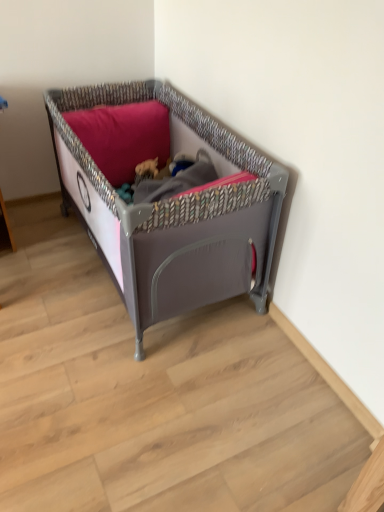
Question: Considering the relative sizes of matte gray plastic playpen at center and matte pink pillow at upper center in the image provided, is matte gray plastic playpen at center shorter than matte pink pillow at upper center?

Choices:
 (A) no
 (B) yes

Answer: (A)

Question: Is matte pink pillow at upper center at the back of matte gray plastic playpen at center?

Choices:
 (A) no
 (B) yes

Answer: (B)

Question: Considering the relative positions of matte gray plastic playpen at center and matte pink pillow at upper center in the image provided, is matte gray plastic playpen at center to the right of matte pink pillow at upper center from the viewer's perspective?

Choices:
 (A) no
 (B) yes

Answer: (B)

Question: Is matte gray plastic playpen at center positioned before matte pink pillow at upper center?

Choices:
 (A) yes
 (B) no

Answer: (A)

Question: Would you say matte pink pillow at upper center is part of matte gray plastic playpen at center's contents?

Choices:
 (A) no
 (B) yes

Answer: (B)

Question: From the image's perspective, is matte gray plastic playpen at center above matte pink pillow at upper center?

Choices:
 (A) yes
 (B) no

Answer: (B)

Question: Is matte pink pillow at upper center next to matte gray plastic playpen at center and touching it?

Choices:
 (A) no
 (B) yes

Answer: (A)

Question: Are matte pink pillow at upper center and matte gray plastic playpen at center far apart?

Choices:
 (A) no
 (B) yes

Answer: (A)

Question: From the image's perspective, does matte pink pillow at upper center appear higher than matte gray plastic playpen at center?

Choices:
 (A) no
 (B) yes

Answer: (B)

Question: From a real-world perspective, is matte pink pillow at upper center located higher than matte gray plastic playpen at center?

Choices:
 (A) yes
 (B) no

Answer: (A)

Question: Is matte pink pillow at upper center completely or partially outside of matte gray plastic playpen at center?

Choices:
 (A) yes
 (B) no

Answer: (B)

Question: Is matte pink pillow at upper center closer to the viewer compared to matte gray plastic playpen at center?

Choices:
 (A) no
 (B) yes

Answer: (A)

Question: Considering the positions of matte gray plastic playpen at center and matte pink pillow at upper center in the image, is matte gray plastic playpen at center wider or thinner than matte pink pillow at upper center?

Choices:
 (A) thin
 (B) wide

Answer: (B)